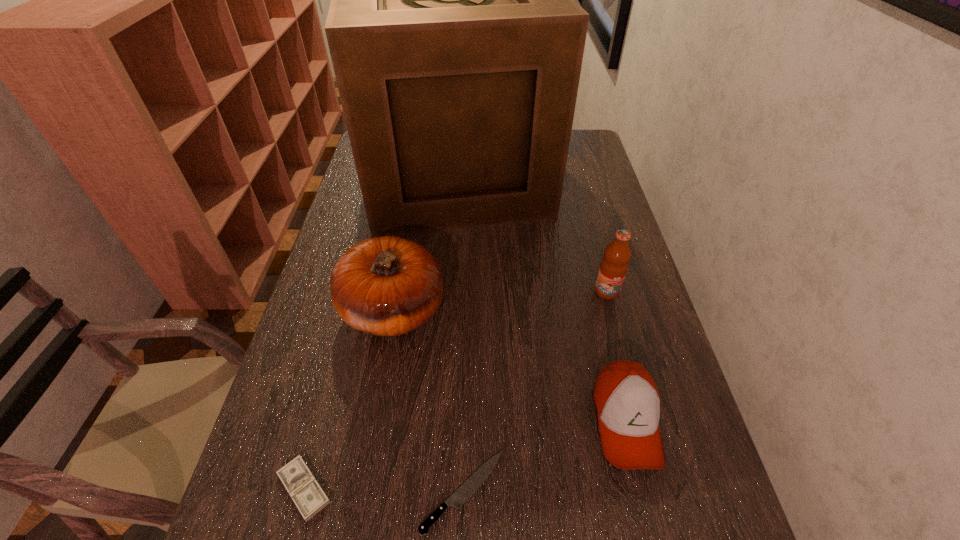
Identify the location of vacant space located on the front-facing side of the third shortest object. This screenshot has height=540, width=960. coord(648,510).

Find the location of a particular element. free space located on the left of the second shortest object is located at coordinates (248, 489).

Find the location of `vacant space located on the back of the shortest object`. vacant space located on the back of the shortest object is located at coordinates (468, 301).

Identify the location of object present at the far edge. (457, 46).

What are the coordinates of `box at the left edge` in the screenshot? It's located at (457, 46).

Where is `pumpkin present at the left edge`? pumpkin present at the left edge is located at coordinates (387, 286).

Where is `money that is at the left edge`? This screenshot has height=540, width=960. money that is at the left edge is located at coordinates (308, 496).

In order to click on fruit juice that is positioned at the right edge in this screenshot , I will do `click(613, 267)`.

Where is `baseball cap that is positioned at the right edge`? This screenshot has width=960, height=540. baseball cap that is positioned at the right edge is located at coordinates (626, 399).

Image resolution: width=960 pixels, height=540 pixels. Find the location of `object that is at the far left corner`. object that is at the far left corner is located at coordinates (457, 46).